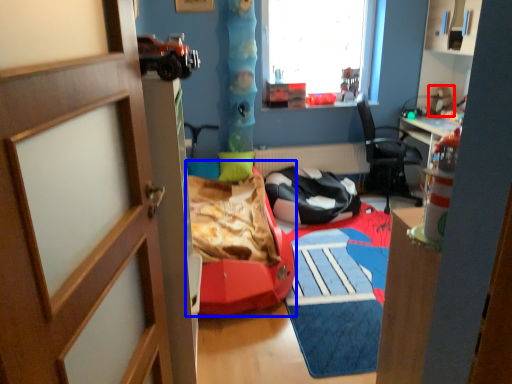
Question: Which of the following is the farthest to the observer, toy (highlighted by a red box) or bed frame (highlighted by a blue box)?

Choices:
 (A) toy
 (B) bed frame

Answer: (A)